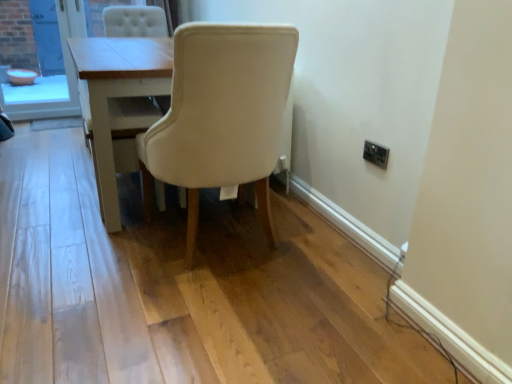
What do you see at coordinates (118, 95) in the screenshot?
I see `light wood table at center` at bounding box center [118, 95].

Image resolution: width=512 pixels, height=384 pixels. What are the coordinates of `black plastic electric outlet at upper right` in the screenshot? It's located at (376, 154).

Measure the distance between beige fabric chair at center and camera.

A distance of 4.51 feet exists between beige fabric chair at center and camera.

I want to click on orange plastic bowl at left, so click(x=51, y=76).

The width and height of the screenshot is (512, 384). Describe the element at coordinates (51, 76) in the screenshot. I see `orange plastic bowl at left` at that location.

Locate an element on the screen. Image resolution: width=512 pixels, height=384 pixels. light wood table at center is located at coordinates (118, 95).

Consider the image. Who is bigger, black plastic electric outlet at upper right or orange plastic bowl at left?

Bigger between the two is orange plastic bowl at left.

Do you think black plastic electric outlet at upper right is within orange plastic bowl at left, or outside of it?

black plastic electric outlet at upper right lies outside orange plastic bowl at left.

Could you tell me if black plastic electric outlet at upper right is facing orange plastic bowl at left?

No, black plastic electric outlet at upper right is not aimed at orange plastic bowl at left.

In the image, is beige fabric chair at center positioned in front of or behind black plastic electric outlet at upper right?

In the image, beige fabric chair at center appears in front of black plastic electric outlet at upper right.

Is beige fabric chair at center inside or outside of black plastic electric outlet at upper right?

beige fabric chair at center cannot be found inside black plastic electric outlet at upper right.

How different are the orientations of beige fabric chair at center and black plastic electric outlet at upper right in degrees?

89.3 degrees.

Is beige fabric chair at center far from black plastic electric outlet at upper right?

No, beige fabric chair at center is not far from black plastic electric outlet at upper right.

Does light wood table at center have a lesser height compared to black plastic electric outlet at upper right?

In fact, light wood table at center may be taller than black plastic electric outlet at upper right.

Consider the image. Who is bigger, light wood table at center or black plastic electric outlet at upper right?

light wood table at center.

Which object is positioned more to the right, light wood table at center or black plastic electric outlet at upper right?

black plastic electric outlet at upper right.

This screenshot has width=512, height=384. I want to click on electric outlet that is above the light wood table at center (from a real-world perspective), so click(376, 154).

Are light wood table at center and orange plastic bowl at left located far from each other?

Absolutely, light wood table at center is distant from orange plastic bowl at left.

Could you tell me if light wood table at center is facing orange plastic bowl at left?

No, light wood table at center does not turn towards orange plastic bowl at left.

Is light wood table at center not inside orange plastic bowl at left?

Yes, light wood table at center is not within orange plastic bowl at left.

Consider the image. Considering the relative positions of light wood table at center and orange plastic bowl at left in the image provided, is light wood table at center behind orange plastic bowl at left?

No, it is not.

Considering the relative sizes of black plastic electric outlet at upper right and light wood table at center in the image provided, is black plastic electric outlet at upper right smaller than light wood table at center?

Indeed, black plastic electric outlet at upper right has a smaller size compared to light wood table at center.

From the image's perspective, is black plastic electric outlet at upper right located above light wood table at center?

No, from the image's perspective, black plastic electric outlet at upper right is not above light wood table at center.

From a real-world perspective, is black plastic electric outlet at upper right beneath light wood table at center?

No, from a real-world perspective, black plastic electric outlet at upper right is not below light wood table at center.

Between black plastic electric outlet at upper right and light wood table at center, which one has more height?

light wood table at center.

Which object is closer to the camera, beige fabric chair at center or light wood table at center?

beige fabric chair at center is more forward.

From a real-world perspective, relative to light wood table at center, is beige fabric chair at center vertically above or below?

beige fabric chair at center is situated higher than light wood table at center in the real world.

Does point (148, 186) come behind point (90, 102)?

That is True.

Can you confirm if beige fabric chair at center is taller than light wood table at center?

Correct, beige fabric chair at center is much taller as light wood table at center.

Is black plastic electric outlet at upper right to the left of beige fabric chair at center from the viewer's perspective?

No, black plastic electric outlet at upper right is not to the left of beige fabric chair at center.

Considering the relative sizes of black plastic electric outlet at upper right and beige fabric chair at center in the image provided, is black plastic electric outlet at upper right smaller than beige fabric chair at center?

Correct, black plastic electric outlet at upper right occupies less space than beige fabric chair at center.

In the scene shown: Is black plastic electric outlet at upper right inside or outside of beige fabric chair at center?

The correct answer is: outside.

Is black plastic electric outlet at upper right turned away from beige fabric chair at center?

That's not correct — black plastic electric outlet at upper right is not looking away from beige fabric chair at center.

Where is `electric outlet that appears in front of the orange plastic bowl at left`? The height and width of the screenshot is (384, 512). electric outlet that appears in front of the orange plastic bowl at left is located at coordinates (376, 154).

Find the location of a particular element. The image size is (512, 384). electric outlet below the beige fabric chair at center (from the image's perspective) is located at coordinates (376, 154).

Based on their spatial positions, is beige fabric chair at center or black plastic electric outlet at upper right further from light wood table at center?

black plastic electric outlet at upper right.

Looking at the image, which one is located closer to light wood table at center, orange plastic bowl at left or beige fabric chair at center?

Among the two, beige fabric chair at center is located nearer to light wood table at center.

Estimate the real-world distances between objects in this image. Which object is further from black plastic electric outlet at upper right, orange plastic bowl at left or light wood table at center?

Based on the image, orange plastic bowl at left appears to be further to black plastic electric outlet at upper right.

In the scene shown: Which object lies further to the anchor point beige fabric chair at center, black plastic electric outlet at upper right or orange plastic bowl at left?

Based on the image, orange plastic bowl at left appears to be further to beige fabric chair at center.

From the image, which object appears to be nearer to beige fabric chair at center, orange plastic bowl at left or light wood table at center?

Based on the image, light wood table at center appears to be nearer to beige fabric chair at center.

Looking at the image, which one is located further to beige fabric chair at center, orange plastic bowl at left or black plastic electric outlet at upper right?

The object further to beige fabric chair at center is orange plastic bowl at left.

Looking at the image, which one is located closer to light wood table at center, beige fabric chair at center or orange plastic bowl at left?

The object closer to light wood table at center is beige fabric chair at center.

When comparing their distances from light wood table at center, does black plastic electric outlet at upper right or orange plastic bowl at left seem closer?

The object closer to light wood table at center is black plastic electric outlet at upper right.

Identify the location of chair situated between orange plastic bowl at left and black plastic electric outlet at upper right from left to right. The image size is (512, 384). [x=221, y=115].

Where is `table between orange plastic bowl at left and black plastic electric outlet at upper right from left to right`? This screenshot has height=384, width=512. table between orange plastic bowl at left and black plastic electric outlet at upper right from left to right is located at coordinates (118, 95).

Find the location of `table between beige fabric chair at center and orange plastic bowl at left along the z-axis`. table between beige fabric chair at center and orange plastic bowl at left along the z-axis is located at coordinates (118, 95).

At what (x,y) coordinates should I click in order to perform the action: click on chair situated between light wood table at center and black plastic electric outlet at upper right from left to right. Please return your answer as a coordinate pair (x, y). Image resolution: width=512 pixels, height=384 pixels. Looking at the image, I should click on (221, 115).